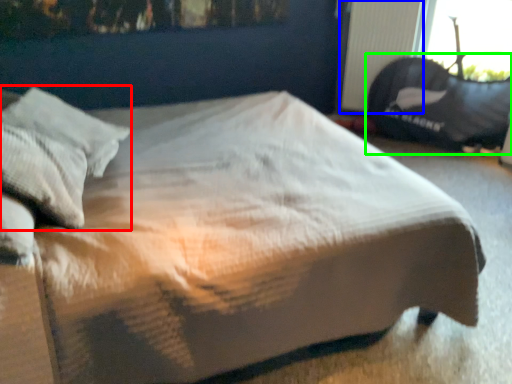
Question: Which is farther away from pillow (highlighted by a red box)? radiator (highlighted by a blue box) or bean bag chair (highlighted by a green box)?

Choices:
 (A) radiator
 (B) bean bag chair

Answer: (B)